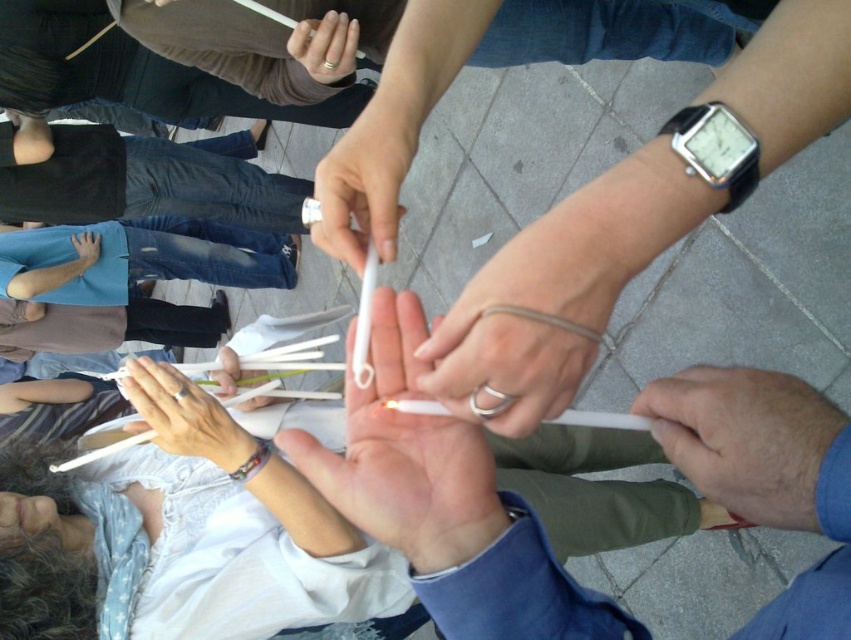
Between point (330, 198) and point (87, 264), which one is positioned in front?

Point (330, 198) is more forward.

Can you confirm if white plastic pen at center is positioned above smooth skin hand at center?

No.

Is point (369, 134) closer to viewer compared to point (90, 234)?

Yes, point (369, 134) is closer to viewer.

Locate an element on the screen. white plastic pen at center is located at coordinates click(x=366, y=180).

Is white plastic pen at center to the right of white matte chopsticks at lower left from the viewer's perspective?

Correct, you'll find white plastic pen at center to the right of white matte chopsticks at lower left.

Between white plastic pen at center and white matte chopsticks at lower left, which one is positioned higher?

Positioned higher is white plastic pen at center.

Between point (380, 241) and point (163, 436), which one is positioned behind?

The point (163, 436) is more distant.

The height and width of the screenshot is (640, 851). Find the location of `white plastic pen at center`. white plastic pen at center is located at coordinates (366, 180).

Can you confirm if smooth white pen at center is bigger than smooth skin hand at center?

Actually, smooth white pen at center might be smaller than smooth skin hand at center.

Is smooth white pen at center above smooth skin hand at center?

Actually, smooth white pen at center is below smooth skin hand at center.

What do you see at coordinates (744, 438) in the screenshot? I see `smooth white pen at center` at bounding box center [744, 438].

Identify the location of smooth white pen at center. (744, 438).